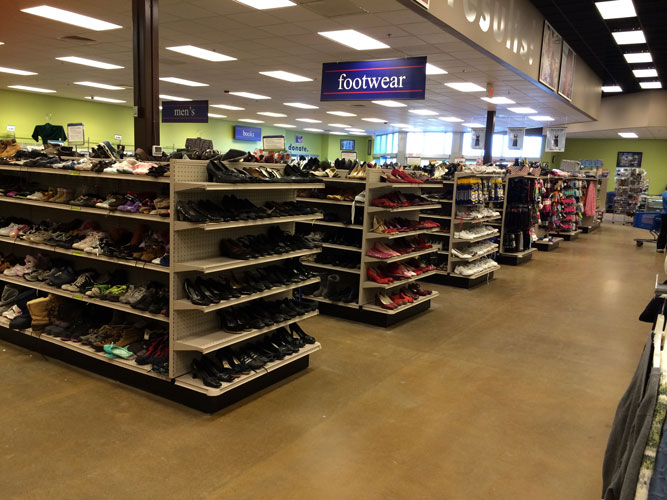
The image size is (667, 500). Identify the location of shelves. (225, 187), (225, 224), (219, 270), (223, 300), (219, 345), (219, 387).